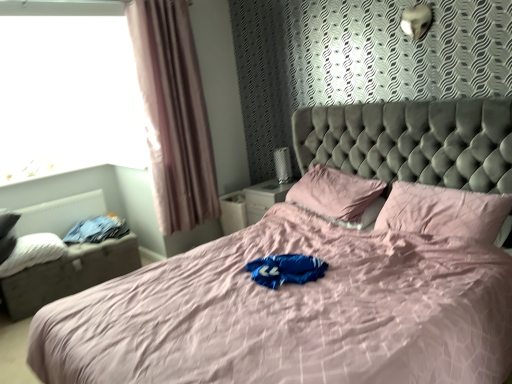
Question: Relative to white textured radiator at left, is pink fabric pillow at center, which is the 2th pillow from right to left, in front or behind?

Choices:
 (A) behind
 (B) front

Answer: (B)

Question: From the image's perspective, is pink fabric pillow at center, which is the 2th pillow from right to left, located above or below white textured radiator at left?

Choices:
 (A) above
 (B) below

Answer: (A)

Question: Which object is positioned farthest from the white soft pillow at left, the first pillow from the left?

Choices:
 (A) white textured radiator at left
 (B) denim fabric footrest at lower left
 (C) pink fabric bed at center
 (D) transparent glass window at upper left
 (E) pink fabric pillow at upper right, positioned as the first pillow in right-to-left order

Answer: (E)

Question: Based on their relative distances, which object is farther from the pink fabric bed at center?

Choices:
 (A) pink fabric pillow at upper right, positioned as the first pillow in right-to-left order
 (B) white textured radiator at left
 (C) white soft pillow at left, the first pillow from the left
 (D) transparent glass window at upper left
 (E) pink fabric pillow at center, which is the 2th pillow from right to left

Answer: (B)